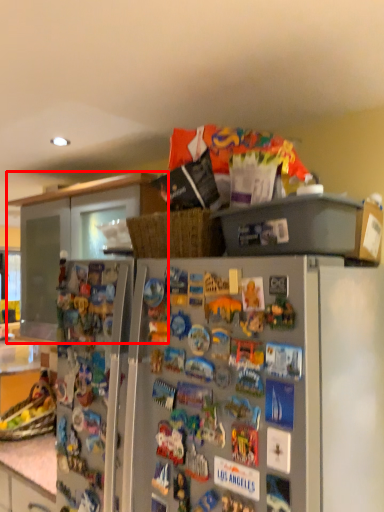
Question: Considering the relative positions of cabinetry (annotated by the red box) and refrigerator in the image provided, where is cabinetry (annotated by the red box) located with respect to the staircase?

Choices:
 (A) right
 (B) left

Answer: (B)